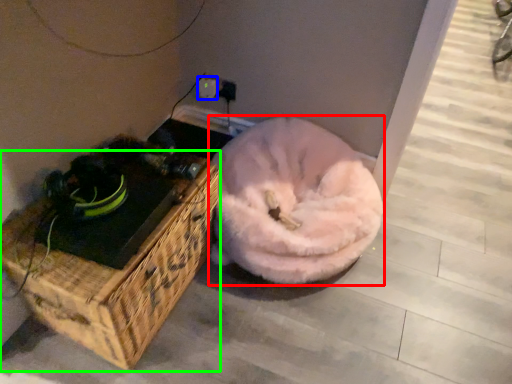
Question: Estimate the real-world distances between objects in this image. Which object is farther from dog bed (highlighted by a red box), electric outlet (highlighted by a blue box) or furniture (highlighted by a green box)?

Choices:
 (A) electric outlet
 (B) furniture

Answer: (A)